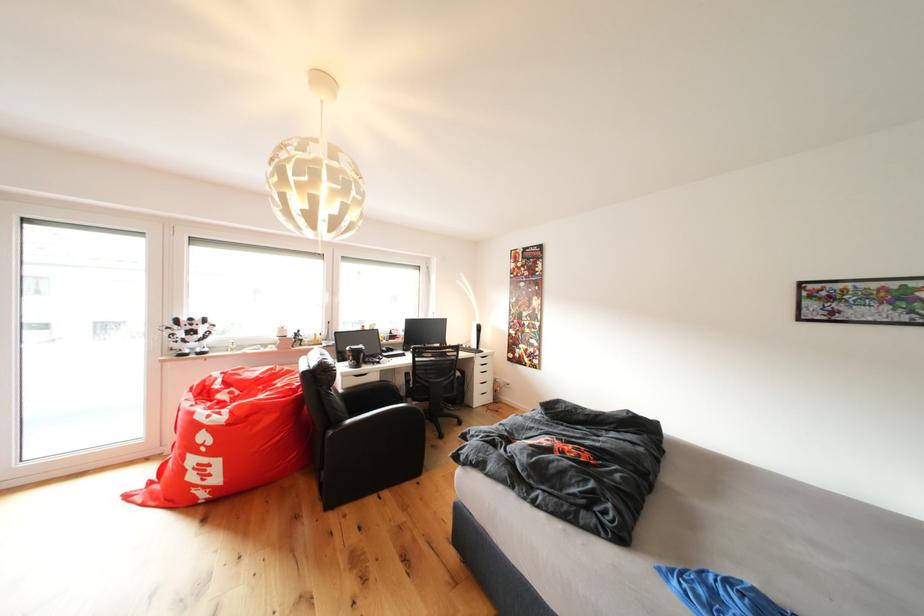
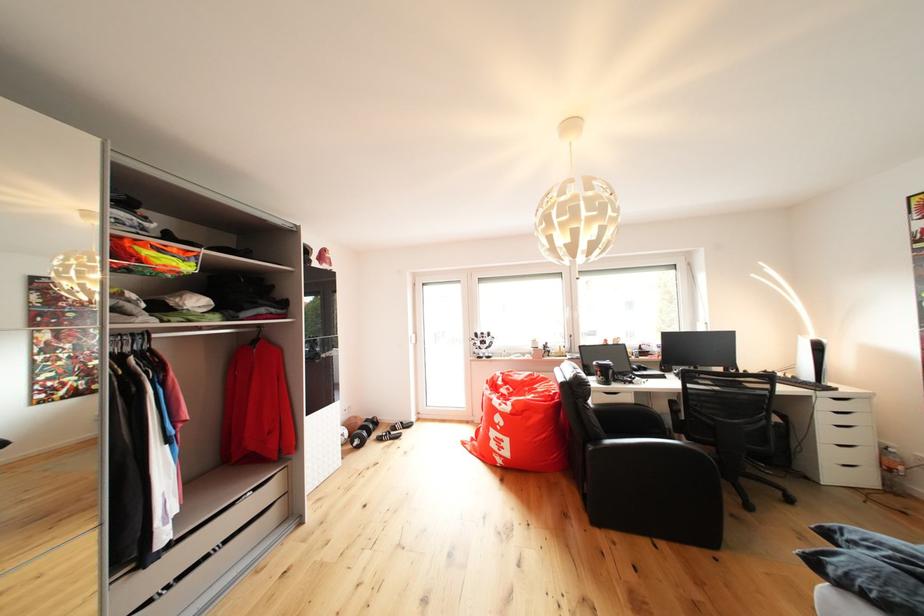
In the second image, find the point that corresponds to pixel 361 355 in the first image.

(609, 371)